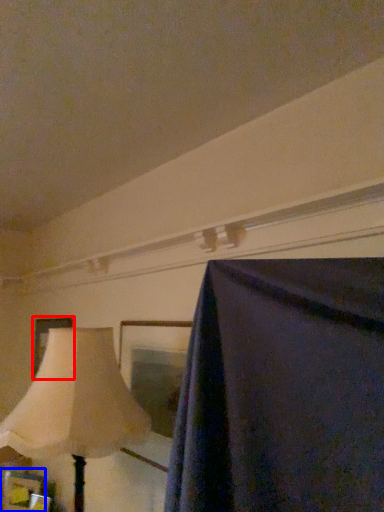
Question: Which object appears farthest to the camera in this image, picture frame (highlighted by a red box) or picture frame (highlighted by a blue box)?

Choices:
 (A) picture frame
 (B) picture frame

Answer: (A)